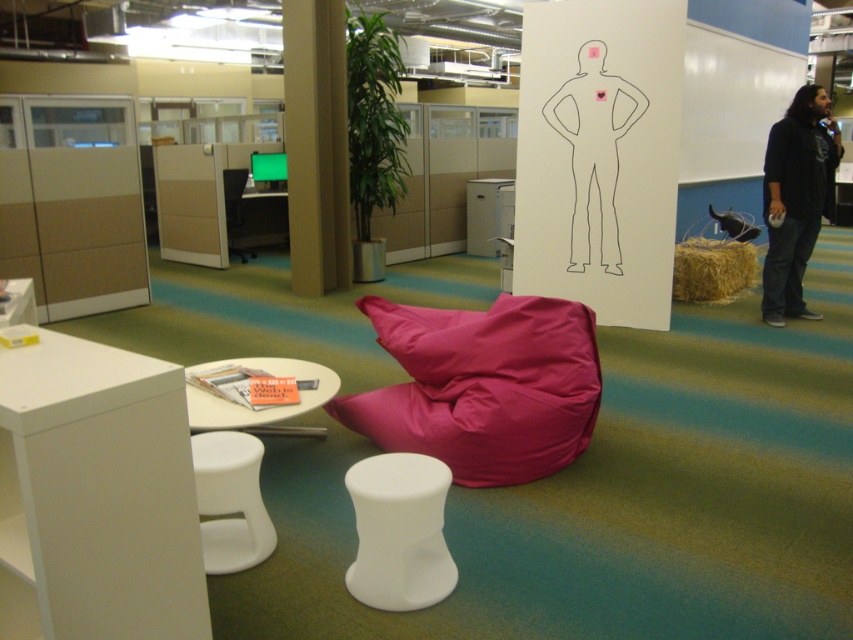
Question: Which of the following is the closest to the observer?

Choices:
 (A) pink fabric bean bag at center
 (B) white glossy table at center

Answer: (B)

Question: Based on their relative distances, which object is nearer to the pink fabric bean bag at center?

Choices:
 (A) black cotton shirt at right
 (B) white matte stool at lower left

Answer: (B)

Question: Does pink fabric bean bag at center appear on the left side of white glossy table at center?

Choices:
 (A) yes
 (B) no

Answer: (B)

Question: Which point is closer to the camera taking this photo?

Choices:
 (A) (587, 316)
 (B) (223, 172)
 (C) (242, 490)
 (D) (221, 404)

Answer: (C)

Question: Can you confirm if white glossy table at lower left is positioned above white matte stool at lower left?

Choices:
 (A) no
 (B) yes

Answer: (B)

Question: Considering the relative positions of black cotton shirt at right and matte black monitor at center in the image provided, where is black cotton shirt at right located with respect to matte black monitor at center?

Choices:
 (A) left
 (B) right

Answer: (B)